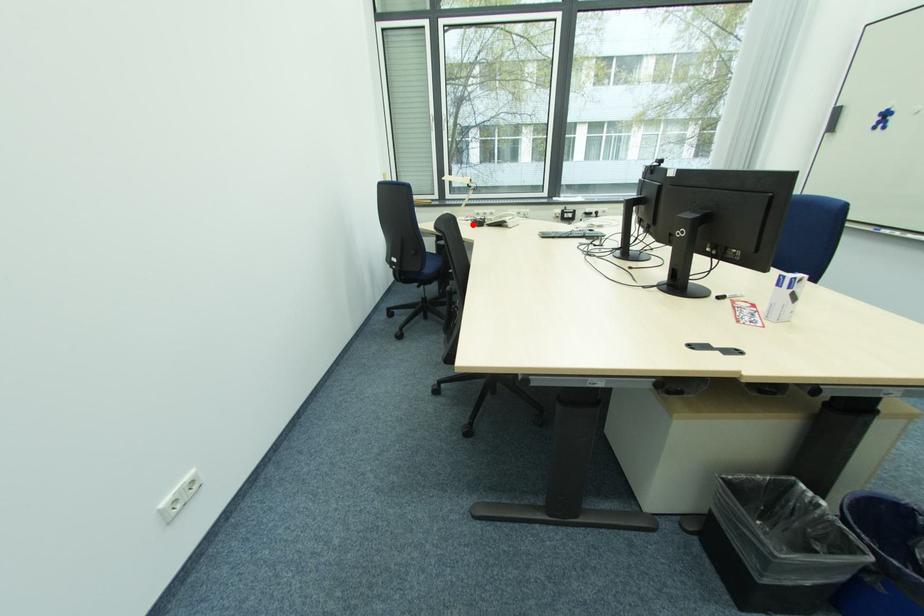
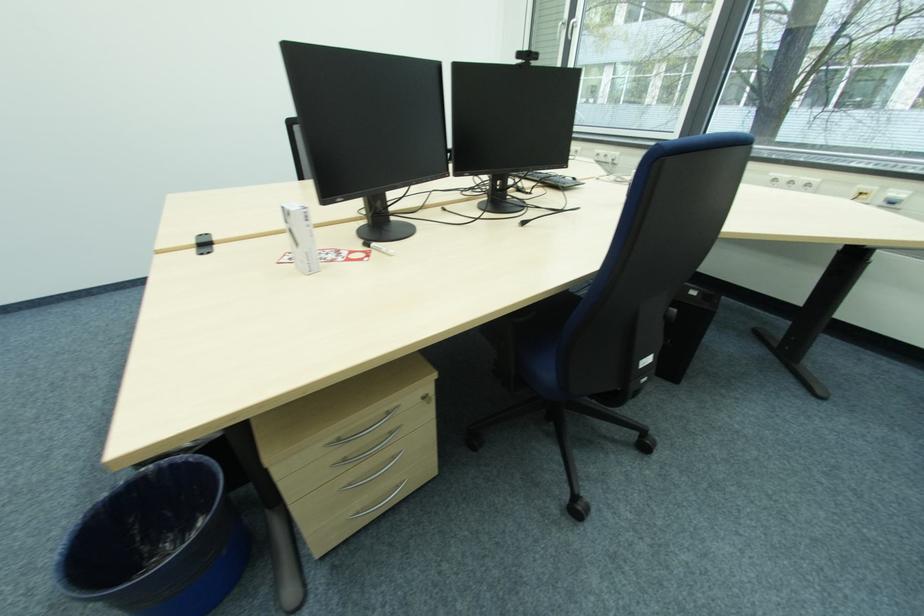
Question: I am providing you with two images of the same scene from different viewpoints. A red point is marked on the first image. Can you still see the location of the red point in image 2?

Choices:
 (A) Yes
 (B) No

Answer: (B)